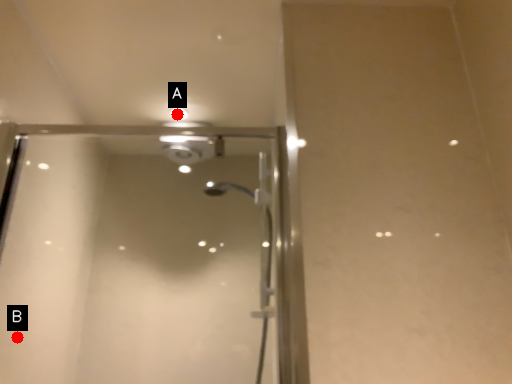
Question: Two points are circled on the image, labeled by A and B beside each circle. Which point is closer to the camera?

Choices:
 (A) A is closer
 (B) B is closer

Answer: (B)